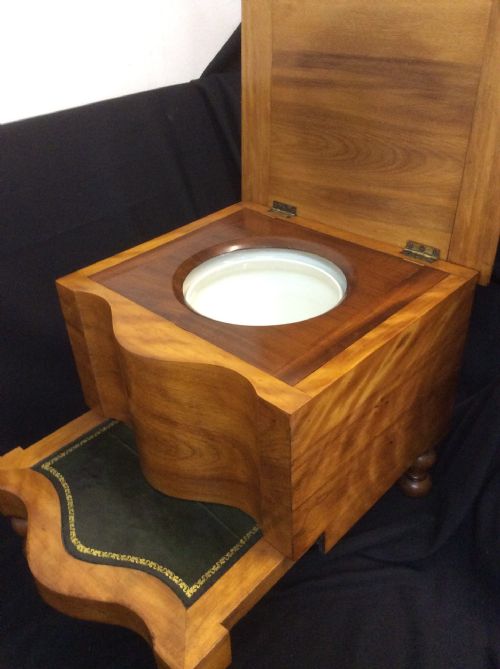
Where is `hinge`? hinge is located at coordinates coord(420,250), coord(283,209).